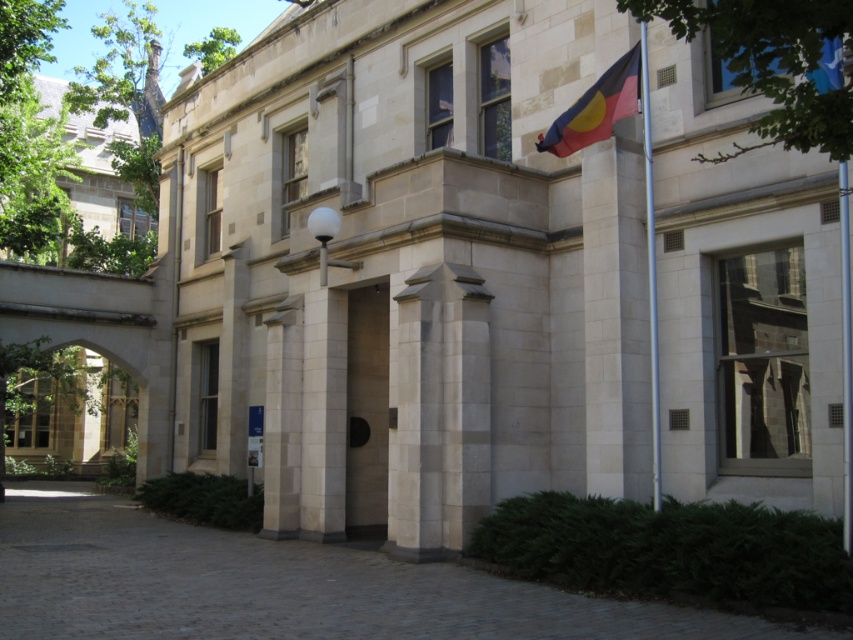
Is point (381, 310) behind point (587, 140)?

Yes.

Between point (346, 518) and point (608, 102), which one is positioned in front?

Point (608, 102) is in front.

Identify the location of smooth stone door at center. (366, 412).

Between textured fabric flag at upper right and silver metallic flag pole at center, which one has more height?

With more height is textured fabric flag at upper right.

I want to click on textured fabric flag at upper right, so click(596, 108).

What are the coordinates of `textured fabric flag at upper right` in the screenshot? It's located at (596, 108).

Does smooth stone door at center have a greater width compared to silver metallic flag pole at center?

Yes, smooth stone door at center is wider than silver metallic flag pole at center.

Is smooth stone door at center above silver metallic flag pole at center?

No, smooth stone door at center is not above silver metallic flag pole at center.

Is point (369, 304) behind point (643, 99)?

Yes, point (369, 304) is farther from viewer.

Identify the location of smooth stone door at center. pos(366,412).